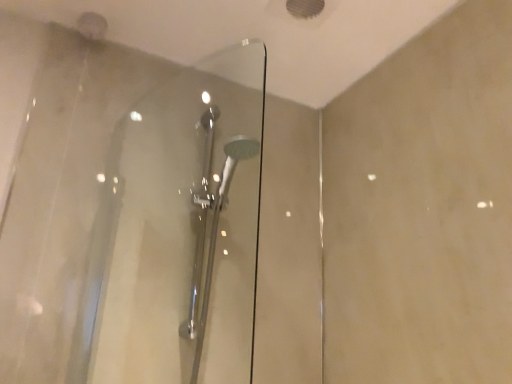
You are a GUI agent. You are given a task and a screenshot of the screen. Output one action in this format:
    pyautogui.click(x=<x>, y=<y>)
    Task: Click on the clear glass shower door at upper left
    This screenshot has width=512, height=384.
    Given the screenshot: What is the action you would take?
    pyautogui.click(x=128, y=212)

The height and width of the screenshot is (384, 512). Describe the element at coordinates (128, 212) in the screenshot. I see `clear glass shower door at upper left` at that location.

The width and height of the screenshot is (512, 384). Find the location of `clear glass shower door at upper left`. clear glass shower door at upper left is located at coordinates (128, 212).